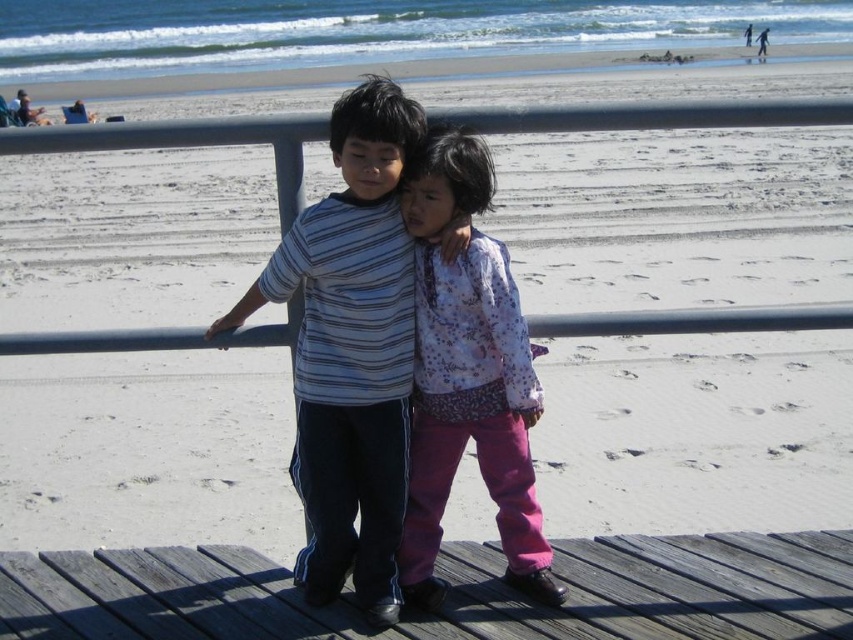
Who is more distant from viewer, (160, 577) or (379, 592)?

The point (160, 577) is more distant.

Does wooden at center have a greater height compared to striped cotton shirt at center?

In fact, wooden at center may be shorter than striped cotton shirt at center.

At what (x,y) coordinates should I click in order to perform the action: click on wooden at center. Please return your answer as a coordinate pair (x, y). The image size is (853, 640). Looking at the image, I should click on (450, 593).

Where is `wooden at center`? wooden at center is located at coordinates (450, 593).

Between striped cotton shirt at center and floral fabric shirt at center, which one has more height?

With more height is striped cotton shirt at center.

Who is higher up, striped cotton shirt at center or floral fabric shirt at center?

striped cotton shirt at center

Identify the location of striped cotton shirt at center. (351, 349).

Identify the location of striped cotton shirt at center. (351, 349).

Does wooden at center appear over floral fabric shirt at center?

No, wooden at center is not above floral fabric shirt at center.

Does point (670, 636) come behind point (448, 333)?

That is False.

Who is more distant from viewer, [769,582] or [433,595]?

The point [769,582] is more distant.

Locate an element on the screen. The image size is (853, 640). wooden at center is located at coordinates (450, 593).